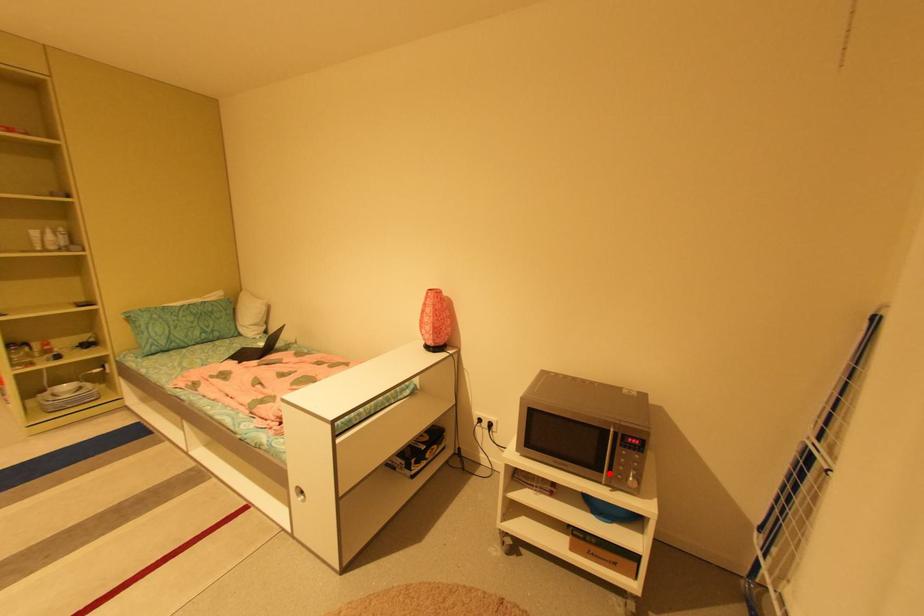
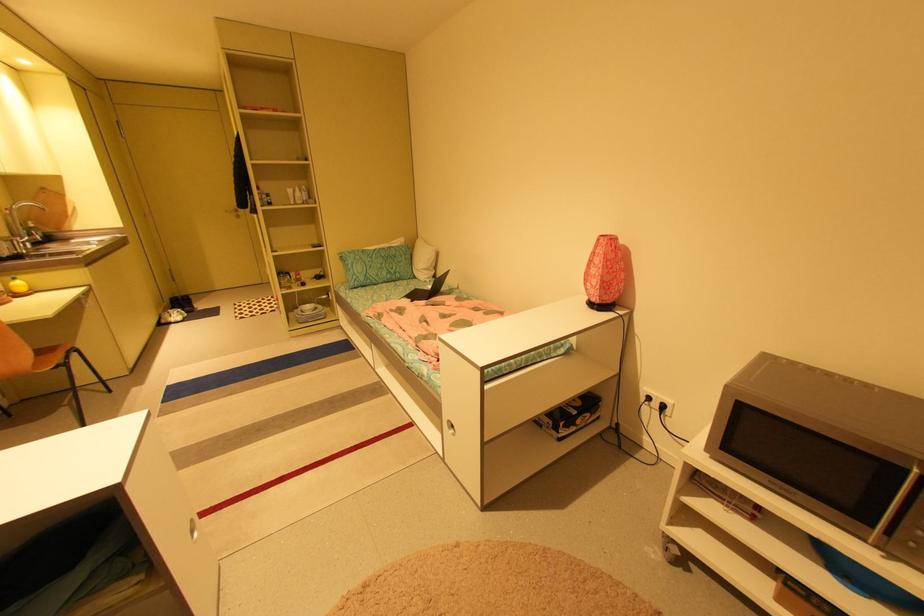
Where in the second image is the point corresponding to the highlighted location from the first image?

(879, 528)